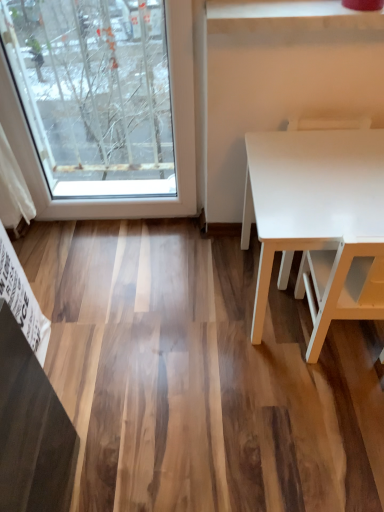
Question: Based on their positions, is white glossy chair at right located to the left or right of white glossy table at right?

Choices:
 (A) right
 (B) left

Answer: (B)

Question: Does point (291, 122) appear closer or farther from the camera than point (284, 190)?

Choices:
 (A) closer
 (B) farther

Answer: (B)

Question: Is white glossy chair at right inside or outside of white glossy table at right?

Choices:
 (A) inside
 (B) outside

Answer: (A)

Question: Based on their sizes in the image, would you say white glossy table at right is bigger or smaller than white glossy chair at right?

Choices:
 (A) big
 (B) small

Answer: (A)

Question: Is white glossy table at right taller or shorter than white glossy chair at right?

Choices:
 (A) short
 (B) tall

Answer: (A)

Question: Considering the positions of point (259, 290) and point (337, 129), is point (259, 290) closer or farther from the camera than point (337, 129)?

Choices:
 (A) closer
 (B) farther

Answer: (A)

Question: In the image, is white glossy table at right positioned in front of or behind white glossy chair at right?

Choices:
 (A) front
 (B) behind

Answer: (A)